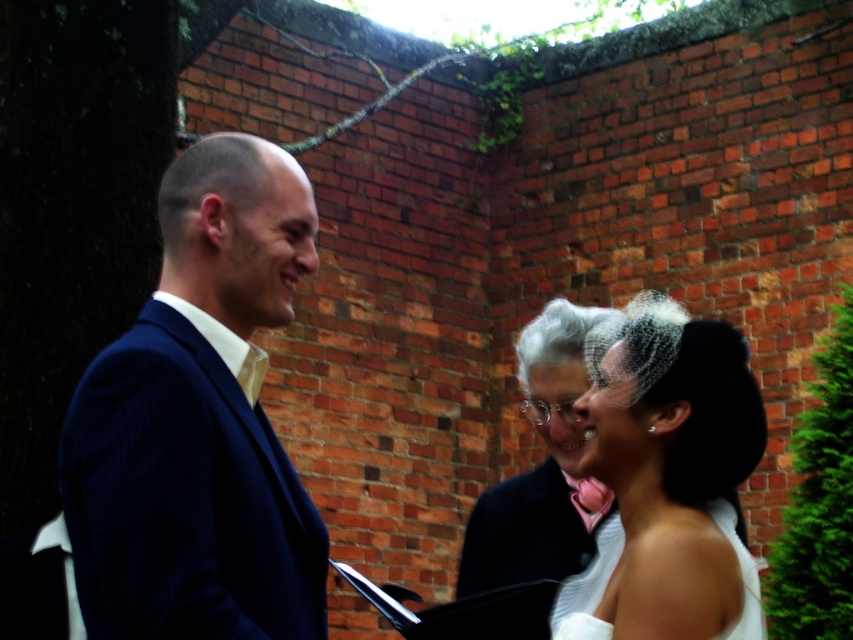
Consider the image. You are a photographer at a wedding ceremony. You need to capture a closeup shot of the couple exchanging vows. The matte black suit at center belongs to the groom and the white satin veil at center belongs to the bride. Since the groom is in front of the bride, will you need to adjust their positions to ensure both are fully visible in the photo?

The matte black suit at center is in front of the white satin veil at center, so the groom is blocking part of the bride. To ensure both are fully visible, you should ask the groom to step slightly to the side or the couple to turn so the bride is more centered.

You are a photographer at a wedding and need to position yourself so that both the matte black suit at center and the navy blue suit at left are fully visible in the frame. Based on their positions and the description, which side should you stand to ensure both are in the shot without any overlap?

You should position yourself to the right side of the scene. Since the matte black suit at center is wider than the navy blue suit at left, standing to the right will allow both suits to be fully visible without overlapping.